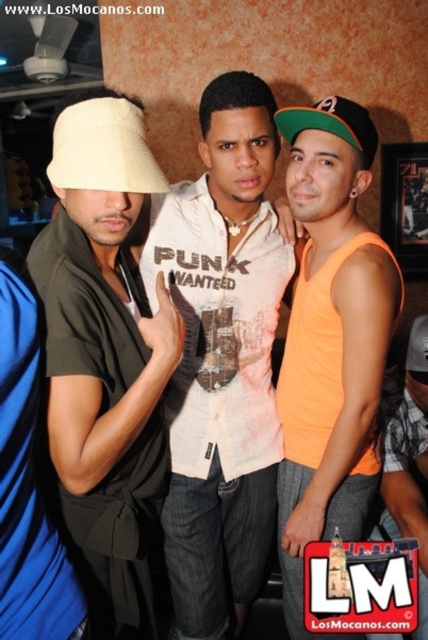
Between orange fabric tank top at center and green fabric baseball cap at upper center, which one appears on the right side from the viewer's perspective?

Positioned to the right is orange fabric tank top at center.

Who is lower down, orange fabric tank top at center or green fabric baseball cap at upper center?

orange fabric tank top at center

Does point (385, 468) lie in front of point (333, 113)?

No, (385, 468) is behind (333, 113).

Locate an element on the screen. orange fabric tank top at center is located at coordinates (407, 460).

Is matte beige hat at left closer to the viewer compared to green fabric baseball cap at upper center?

Yes.

Where is `matte beige hat at left`? The width and height of the screenshot is (428, 640). matte beige hat at left is located at coordinates (107, 371).

From the picture: Can you confirm if orange fabric tank top at right is taller than green fabric baseball cap at upper center?

Yes.

Who is more forward, (x=371, y=438) or (x=362, y=140)?

Positioned in front is point (x=362, y=140).

Is point (333, 195) positioned before point (276, 115)?

Yes.

At what (x,y) coordinates should I click in order to perform the action: click on orange fabric tank top at right. Please return your answer as a coordinate pair (x, y). Looking at the image, I should click on (329, 339).